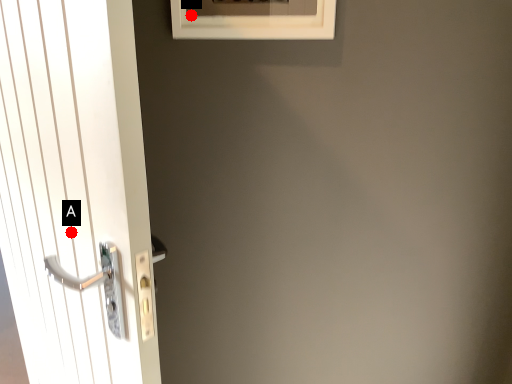
Question: Two points are circled on the image, labeled by A and B beside each circle. Which point appears closest to the camera in this image?

Choices:
 (A) A is closer
 (B) B is closer

Answer: (A)